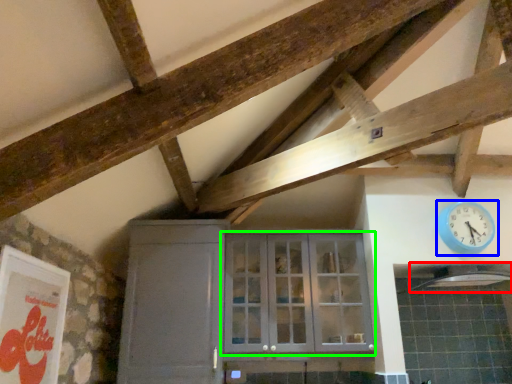
Question: Based on their relative distances, which object is nearer to exhaust hood (highlighted by a red box)? Choose from wall clock (highlighted by a blue box) and window (highlighted by a green box).

Choices:
 (A) wall clock
 (B) window

Answer: (A)